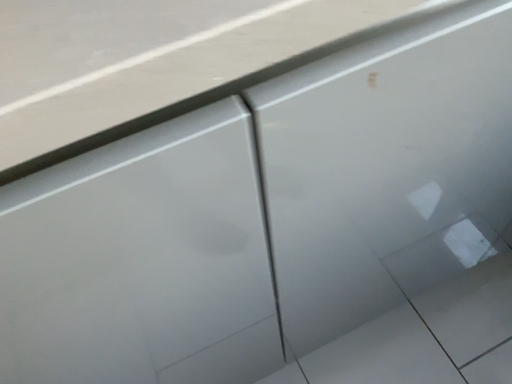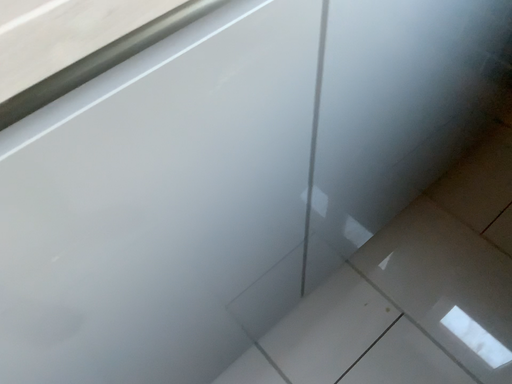
Question: Which way did the camera rotate in the video?

Choices:
 (A) rotated left
 (B) rotated right

Answer: (B)